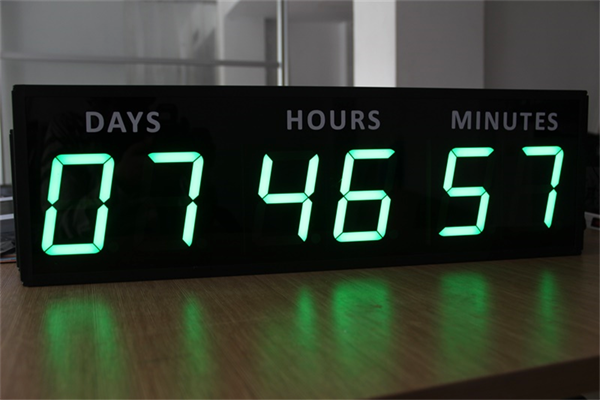
You are a GUI agent. You are given a task and a screenshot of the screen. Output one action in this format:
    pyautogui.click(x=<x>, y=<y>)
    Task: Click on the top of table
    This screenshot has width=600, height=400.
    Given the screenshot: What is the action you would take?
    pyautogui.click(x=281, y=332)